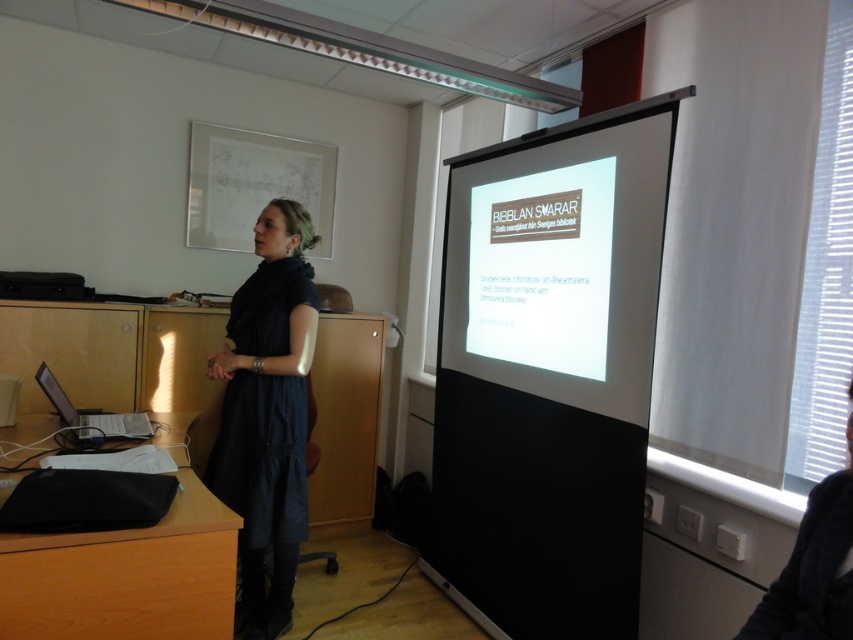
You are a photographer in the room and want to capture a photo of the dark blue dress at center and the matte black laptop at left. Which object should you focus on first to ensure both are in frame?

The dark blue dress at center is much taller than the matte black laptop at left, so you should focus on the dark blue dress at center first to ensure both are in frame.